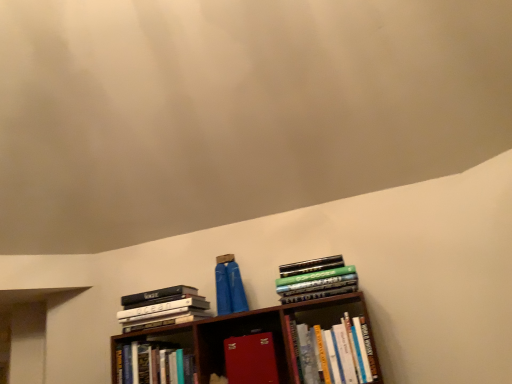
In order to face hardcover books at upper right, acting as the 4th book starting from the left, should I rotate leftwards or rightwards?

Turn right approximately 8.339 degrees to face it.

The image size is (512, 384). Describe the element at coordinates (339, 352) in the screenshot. I see `hardcover books at center, which is the first book in right-to-left order` at that location.

The height and width of the screenshot is (384, 512). Identify the location of hardcover books at center, the 5th book in the left-to-right sequence. (339, 352).

Locate an element on the screen. matte red suitcase at center, marked as the third book in a left-to-right arrangement is located at coordinates (251, 359).

Where is `hardcover books at upper right, acting as the 4th book starting from the left`? This screenshot has width=512, height=384. hardcover books at upper right, acting as the 4th book starting from the left is located at coordinates (317, 284).

Consider the image. Would you say hardcover books at left, placed as the 1th book when sorted from left to right, is inside or outside hardcover book at lower left, the 2th book in the left-to-right sequence?

hardcover books at left, placed as the 1th book when sorted from left to right, is not enclosed by hardcover book at lower left, the 2th book in the left-to-right sequence.

Considering the relative positions of hardcover books at left, placed as the 1th book when sorted from left to right, and hardcover book at lower left, positioned as the 4th book in right-to-left order, in the image provided, is hardcover books at left, placed as the 1th book when sorted from left to right, to the right of hardcover book at lower left, positioned as the 4th book in right-to-left order, from the viewer's perspective?

No.

Is hardcover books at left, placed as the 1th book when sorted from left to right, oriented towards hardcover book at lower left, the 2th book in the left-to-right sequence?

No, hardcover books at left, placed as the 1th book when sorted from left to right, does not turn towards hardcover book at lower left, the 2th book in the left-to-right sequence.

Between hardcover books at left, the fifth book when ordered from right to left, and matte red suitcase at center, marked as the third book in a left-to-right arrangement, which one has smaller width?

Thinner between the two is matte red suitcase at center, marked as the third book in a left-to-right arrangement.

Considering the positions of objects hardcover books at left, the fifth book when ordered from right to left, and matte red suitcase at center, marked as the third book in a left-to-right arrangement, in the image provided, who is in front, hardcover books at left, the fifth book when ordered from right to left, or matte red suitcase at center, marked as the third book in a left-to-right arrangement,?

matte red suitcase at center, marked as the third book in a left-to-right arrangement, is in front.

Is point (142, 305) positioned behind point (260, 345)?

Yes, point (142, 305) is farther from viewer.

Who is taller, hardcover books at left, placed as the 1th book when sorted from left to right, or matte red suitcase at center, marked as the third book in a left-to-right arrangement?

matte red suitcase at center, marked as the third book in a left-to-right arrangement.

Is hardcover books at center, which is the first book in right-to-left order, aimed at matte red suitcase at center, the 3th book positioned from the right?

No.

Is hardcover books at center, the 5th book in the left-to-right sequence, bigger than matte red suitcase at center, marked as the third book in a left-to-right arrangement?

Yes, hardcover books at center, the 5th book in the left-to-right sequence, is bigger than matte red suitcase at center, marked as the third book in a left-to-right arrangement.

There is a matte red suitcase at center, the 3th book positioned from the right. At what (x,y) coordinates should I click in order to perform the action: click on the 1st book above it (from a real-world perspective). Please return your answer as a coordinate pair (x, y). The height and width of the screenshot is (384, 512). Looking at the image, I should click on (339, 352).

Visually, is hardcover books at center, which is the first book in right-to-left order, positioned to the left or to the right of matte red suitcase at center, the 3th book positioned from the right?

Based on their positions, hardcover books at center, which is the first book in right-to-left order, is located to the right of matte red suitcase at center, the 3th book positioned from the right.

Is hardcover book at lower left, the 2th book in the left-to-right sequence, positioned with its back to hardcover books at upper right, the second book when ordered from right to left?

No, hardcover books at upper right, the second book when ordered from right to left, is not at the back of hardcover book at lower left, the 2th book in the left-to-right sequence.

From a real-world perspective, which object rests below the other?

From a 3D spatial view, hardcover book at lower left, positioned as the 4th book in right-to-left order, is below.

From the image's perspective, is hardcover book at lower left, the 2th book in the left-to-right sequence, above or below hardcover books at upper right, acting as the 4th book starting from the left?

Based on their image positions, hardcover book at lower left, the 2th book in the left-to-right sequence, is located beneath hardcover books at upper right, acting as the 4th book starting from the left.

Between point (121, 365) and point (328, 286), which one is positioned in front?

Point (328, 286)

Is matte red suitcase at center, marked as the third book in a left-to-right arrangement, aimed at hardcover book at lower left, the 2th book in the left-to-right sequence?

No.

From a real-world perspective, is matte red suitcase at center, the 3th book positioned from the right, positioned over hardcover book at lower left, the 2th book in the left-to-right sequence, based on gravity?

Incorrect, from a real-world perspective, matte red suitcase at center, the 3th book positioned from the right, is lower than hardcover book at lower left, the 2th book in the left-to-right sequence.

Is matte red suitcase at center, marked as the third book in a left-to-right arrangement, thinner than hardcover book at lower left, the 2th book in the left-to-right sequence?

No.

Which of these two, matte red suitcase at center, the 3th book positioned from the right, or hardcover book at lower left, the 2th book in the left-to-right sequence, stands shorter?

Standing shorter between the two is hardcover book at lower left, the 2th book in the left-to-right sequence.

From a real-world perspective, is hardcover books at upper right, the second book when ordered from right to left, on hardcover books at left, placed as the 1th book when sorted from left to right?

No, from a real-world perspective, hardcover books at upper right, the second book when ordered from right to left, is not on top of hardcover books at left, placed as the 1th book when sorted from left to right.

Which is in front, point (343, 270) or point (126, 322)?

Point (343, 270)

Considering the sizes of objects hardcover books at upper right, the second book when ordered from right to left, and hardcover books at left, the fifth book when ordered from right to left, in the image provided, who is smaller, hardcover books at upper right, the second book when ordered from right to left, or hardcover books at left, the fifth book when ordered from right to left,?

hardcover books at upper right, the second book when ordered from right to left, is smaller.

How many degrees apart are the facing directions of hardcover books at upper right, acting as the 4th book starting from the left, and hardcover books at left, the fifth book when ordered from right to left?

They differ by 2.22 degrees in their facing directions.

From the image's perspective, would you say hardcover books at upper right, acting as the 4th book starting from the left, is shown under hardcover books at center, which is the first book in right-to-left order?

Actually, hardcover books at upper right, acting as the 4th book starting from the left, appears above hardcover books at center, which is the first book in right-to-left order, in the image.

Considering the relative sizes of hardcover books at upper right, the second book when ordered from right to left, and hardcover books at center, the 5th book in the left-to-right sequence, in the image provided, is hardcover books at upper right, the second book when ordered from right to left, wider than hardcover books at center, the 5th book in the left-to-right sequence,?

Indeed, hardcover books at upper right, the second book when ordered from right to left, has a greater width compared to hardcover books at center, the 5th book in the left-to-right sequence.

Which is in front, hardcover books at upper right, the second book when ordered from right to left, or hardcover books at center, which is the first book in right-to-left order?

hardcover books at center, which is the first book in right-to-left order, is in front.

Are hardcover books at upper right, the second book when ordered from right to left, and hardcover books at center, the 5th book in the left-to-right sequence, making contact?

No, hardcover books at upper right, the second book when ordered from right to left, is not with hardcover books at center, the 5th book in the left-to-right sequence.

At what (x,y) coordinates should I click in order to perform the action: click on book that is behind the hardcover book at lower left, the 2th book in the left-to-right sequence. Please return your answer as a coordinate pair (x, y). Image resolution: width=512 pixels, height=384 pixels. Looking at the image, I should click on (165, 309).

Identify the location of the 2nd book below the hardcover books at left, placed as the 1th book when sorted from left to right (from the image's perspective). (251, 359).

Considering their positions, is matte red suitcase at center, marked as the third book in a left-to-right arrangement, positioned further to hardcover books at left, the fifth book when ordered from right to left, than hardcover books at upper right, acting as the 4th book starting from the left?

Based on the image, hardcover books at upper right, acting as the 4th book starting from the left, appears to be further to hardcover books at left, the fifth book when ordered from right to left.

Which object lies nearer to the anchor point hardcover books at center, the 5th book in the left-to-right sequence, hardcover book at lower left, the 2th book in the left-to-right sequence, or matte red suitcase at center, the 3th book positioned from the right?

The object closer to hardcover books at center, the 5th book in the left-to-right sequence, is matte red suitcase at center, the 3th book positioned from the right.

Looking at the image, which one is located further to matte red suitcase at center, the 3th book positioned from the right, hardcover book at lower left, the 2th book in the left-to-right sequence, or hardcover books at center, which is the first book in right-to-left order?

Among the two, hardcover book at lower left, the 2th book in the left-to-right sequence, is located further to matte red suitcase at center, the 3th book positioned from the right.

Looking at the image, which one is located closer to matte red suitcase at center, the 3th book positioned from the right, hardcover books at left, the fifth book when ordered from right to left, or hardcover books at upper right, the second book when ordered from right to left?

The object closer to matte red suitcase at center, the 3th book positioned from the right, is hardcover books at upper right, the second book when ordered from right to left.

Considering their positions, is hardcover books at left, placed as the 1th book when sorted from left to right, positioned closer to hardcover books at center, the 5th book in the left-to-right sequence, than matte red suitcase at center, the 3th book positioned from the right?

Among the two, matte red suitcase at center, the 3th book positioned from the right, is located nearer to hardcover books at center, the 5th book in the left-to-right sequence.

When comparing their distances from hardcover book at lower left, the 2th book in the left-to-right sequence, does hardcover books at upper right, the second book when ordered from right to left, or hardcover books at center, which is the first book in right-to-left order, seem closer?

hardcover books at upper right, the second book when ordered from right to left, is closer to hardcover book at lower left, the 2th book in the left-to-right sequence.

Based on their spatial positions, is hardcover books at center, the 5th book in the left-to-right sequence, or hardcover book at lower left, the 2th book in the left-to-right sequence, closer to hardcover books at upper right, acting as the 4th book starting from the left?

Among the two, hardcover books at center, the 5th book in the left-to-right sequence, is located nearer to hardcover books at upper right, acting as the 4th book starting from the left.

When comparing their distances from hardcover books at upper right, acting as the 4th book starting from the left, does hardcover books at left, the fifth book when ordered from right to left, or matte red suitcase at center, the 3th book positioned from the right, seem closer?

matte red suitcase at center, the 3th book positioned from the right, is closer to hardcover books at upper right, acting as the 4th book starting from the left.

Find the location of `book between hardcover books at left, the fifth book when ordered from right to left, and matte red suitcase at center, the 3th book positioned from the right, from left to right`. book between hardcover books at left, the fifth book when ordered from right to left, and matte red suitcase at center, the 3th book positioned from the right, from left to right is located at coordinates coord(154,364).

The image size is (512, 384). Identify the location of book located between matte red suitcase at center, marked as the third book in a left-to-right arrangement, and hardcover books at center, which is the first book in right-to-left order, in the left-right direction. (317, 284).

Image resolution: width=512 pixels, height=384 pixels. Identify the location of book between hardcover book at lower left, the 2th book in the left-to-right sequence, and hardcover books at upper right, acting as the 4th book starting from the left, from left to right. (251, 359).